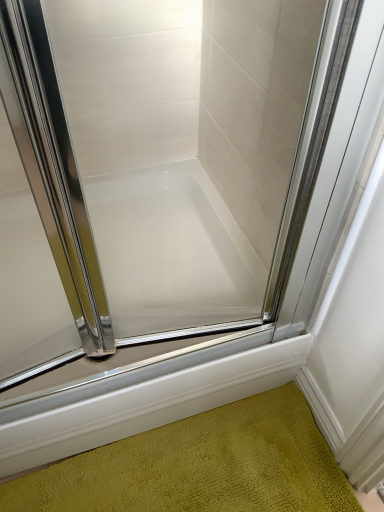
What do you see at coordinates (200, 466) in the screenshot?
I see `green textured bath mat at lower center` at bounding box center [200, 466].

This screenshot has width=384, height=512. I want to click on green textured bath mat at lower center, so [x=200, y=466].

Image resolution: width=384 pixels, height=512 pixels. Identify the location of green textured bath mat at lower center. (200, 466).